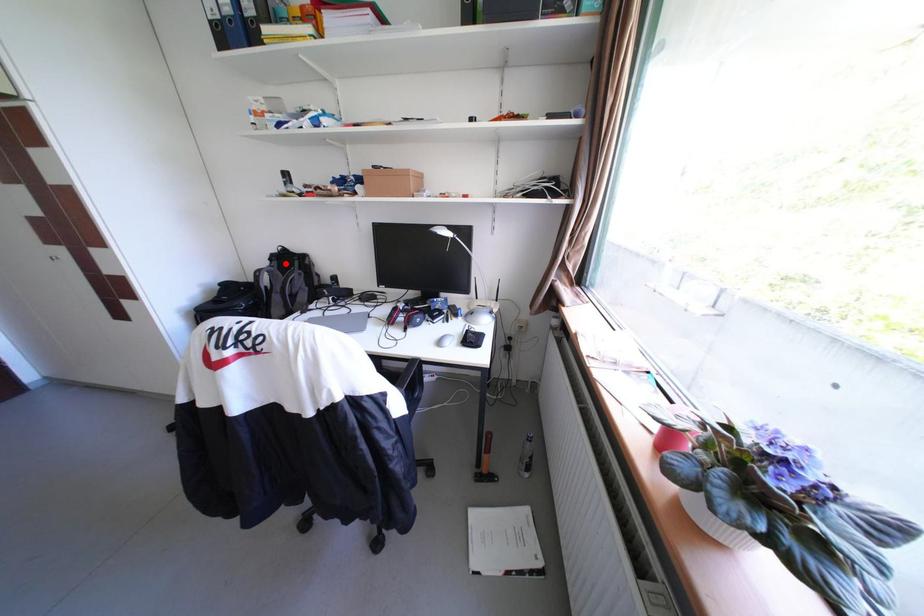
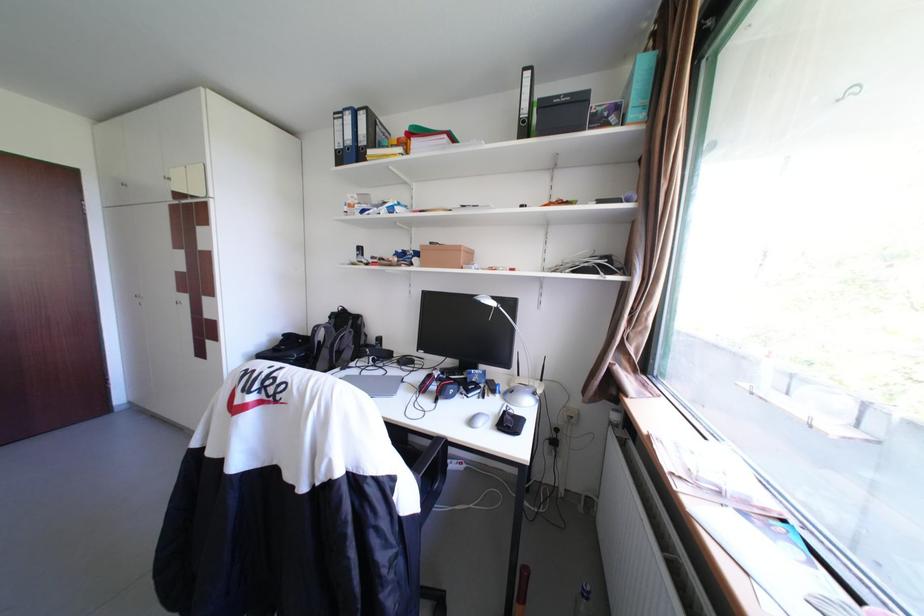
The point at the highlighted location is marked in the first image. Where is the corresponding point in the second image?

(344, 321)